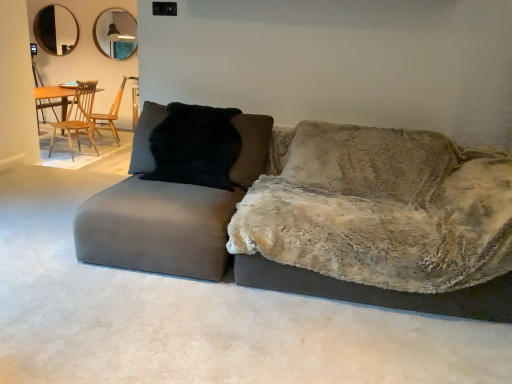
Question: Based on their positions, is velvet gray couch at center located to the left or right of black glass mirror at upper left, the 2th mirror when ordered from right to left?

Choices:
 (A) left
 (B) right

Answer: (B)

Question: From a real-world perspective, is velvet gray couch at center above or below black glass mirror at upper left, the 2th mirror when ordered from right to left?

Choices:
 (A) above
 (B) below

Answer: (B)

Question: Estimate the real-world distances between objects in this image. Which object is closer to the matte silver mirror at upper center, the 1th mirror in the right-to-left sequence?

Choices:
 (A) black fur pillow at center
 (B) wooden chair at center, the 2th chair when ordered from front to back
 (C) matte gray swivel chair at left
 (D) black glass mirror at upper left, marked as the 1th mirror in a left-to-right arrangement
 (E) velvet gray couch at center

Answer: (D)

Question: Which of these objects is positioned farthest from the wooden chair at left, arranged as the first chair when viewed from the front?

Choices:
 (A) wooden chair at center, the 2th chair when ordered from front to back
 (B) black glass mirror at upper left, the 2th mirror when ordered from right to left
 (C) matte silver mirror at upper center, arranged as the 2th mirror when viewed from the left
 (D) velvet gray couch at center
 (E) black fur pillow at center

Answer: (D)